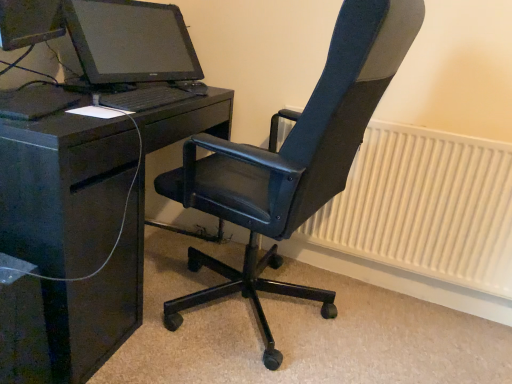
In order to click on vacant space in front of white textured radiator at right in this screenshot , I will do point(379,332).